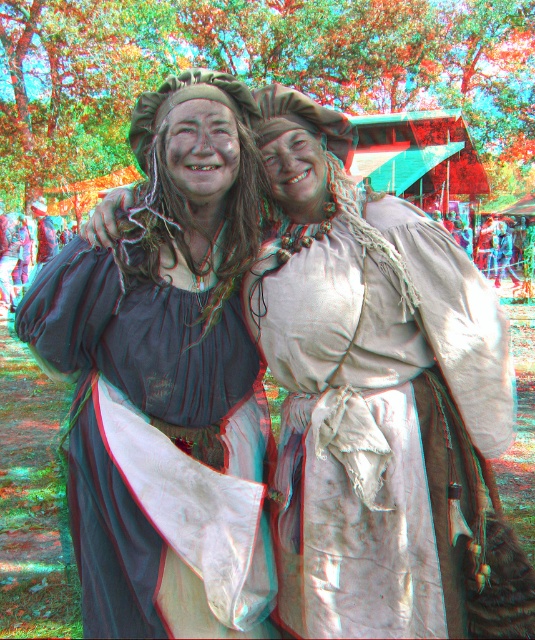
You are a photographer at a historical event and need to ensure that both the matte beige dress at center and the matte black dress at center are visible in the photo. Based on their positions, which dress might be partially hidden and why?

The matte black dress at center is partially hidden because the matte beige dress at center is positioned over it.

You are a photographer at a medieval festival and need to position the matte beige dress at center and the matte black dress at center so that both are visible in the frame. Which dress should you move closer to the camera to ensure both are fully visible?

The matte black dress at center should be moved closer to the camera because it is smaller in size than the matte beige dress at center, allowing both to fit within the frame when adjusted appropriately.